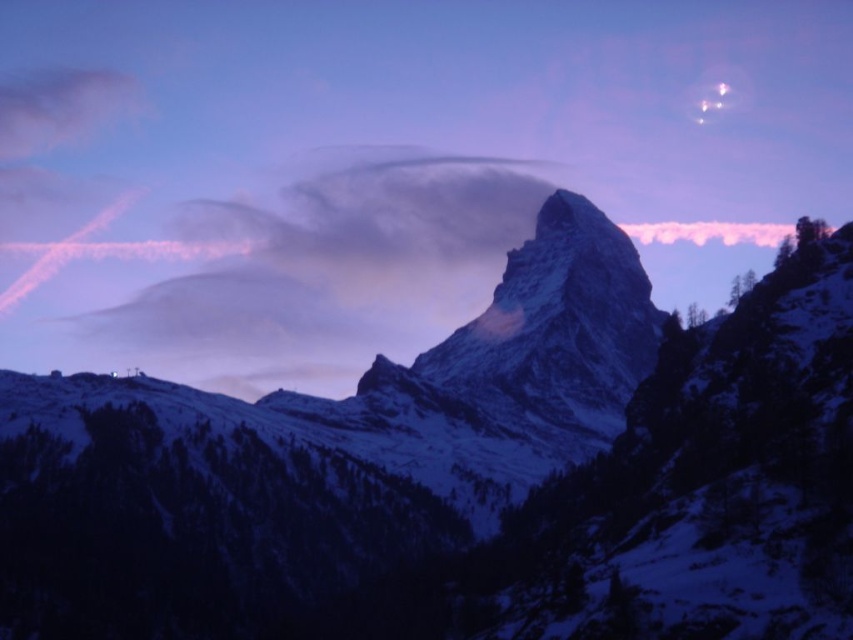
Question: Which point is closer to the camera taking this photo?

Choices:
 (A) (370, 170)
 (B) (631, 513)

Answer: (B)

Question: Does snowy granite mountain at center come in front of white fluffy cloud at center?

Choices:
 (A) yes
 (B) no

Answer: (A)

Question: Which point is farther from the camera taking this photo?

Choices:
 (A) (711, 481)
 (B) (251, 381)

Answer: (B)

Question: Can you confirm if snowy granite mountain at center is wider than white fluffy cloud at center?

Choices:
 (A) no
 (B) yes

Answer: (A)

Question: Which point is closer to the camera?

Choices:
 (A) (495, 216)
 (B) (115, 577)

Answer: (B)

Question: Does snowy granite mountain at center appear on the left side of white fluffy cloud at center?

Choices:
 (A) yes
 (B) no

Answer: (B)